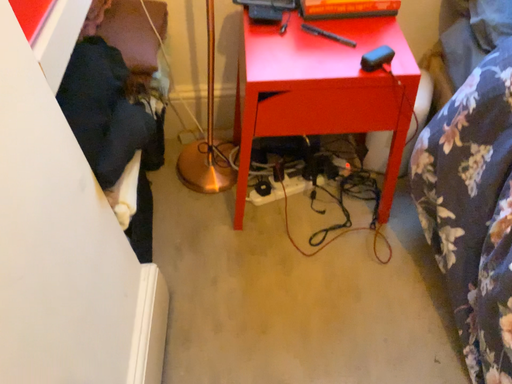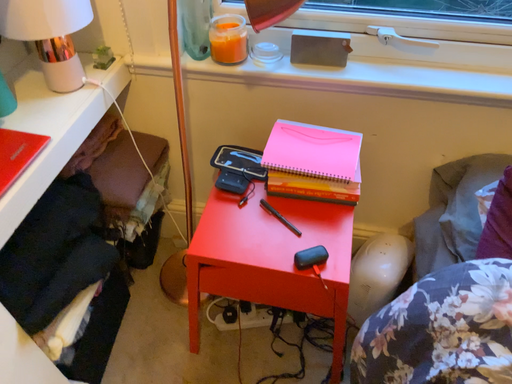
Question: How did the camera likely rotate when shooting the video?

Choices:
 (A) rotated left
 (B) rotated right

Answer: (A)